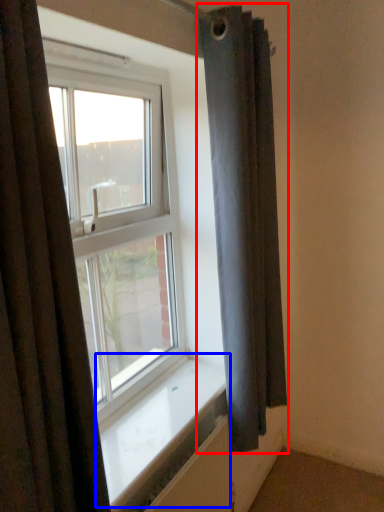
Question: Which of the following is the farthest to the observer, curtain (highlighted by a red box) or window sill (highlighted by a blue box)?

Choices:
 (A) curtain
 (B) window sill

Answer: (A)